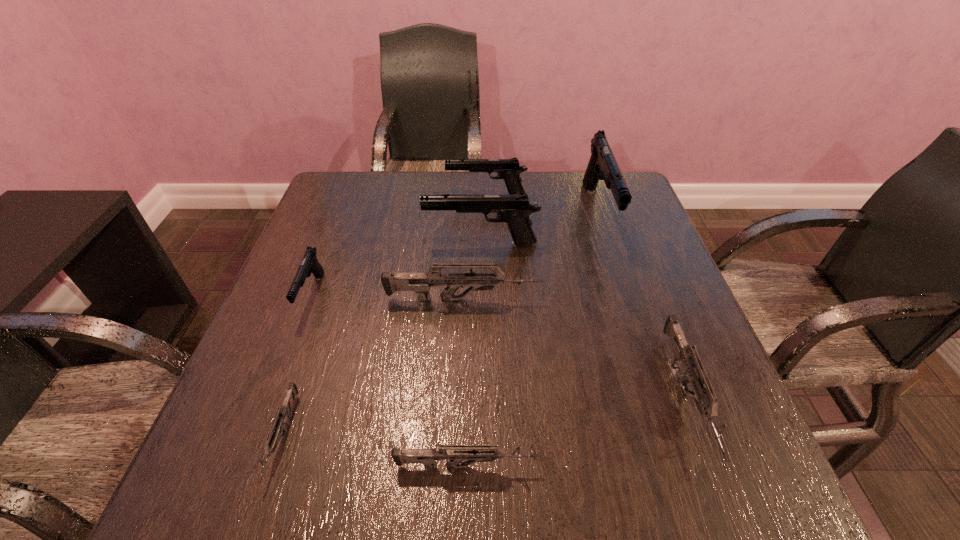
Locate an element on the screen. The height and width of the screenshot is (540, 960). free space located at the aiming end of the second smallest black gun is located at coordinates (374, 195).

You are a GUI agent. You are given a task and a screenshot of the screen. Output one action in this format:
    pyautogui.click(x=<x>, y=<y>)
    Task: Click on the free location located aimed along the barrel of the farthest grey gun
    The image size is (960, 540).
    Given the screenshot: What is the action you would take?
    pyautogui.click(x=654, y=299)

This screenshot has width=960, height=540. Identify the location of free spot located at the aiming end of the leftmost gun. (251, 457).

Image resolution: width=960 pixels, height=540 pixels. In order to click on free spot located 0.350m aimed along the barrel of the third biggest grey gun in this screenshot , I will do `click(764, 466)`.

You are a GUI agent. You are given a task and a screenshot of the screen. Output one action in this format:
    pyautogui.click(x=<x>, y=<y>)
    Task: Click on the object positioned at the near left corner
    This screenshot has width=960, height=540.
    Given the screenshot: What is the action you would take?
    pyautogui.click(x=273, y=438)

You are a GUI agent. You are given a task and a screenshot of the screen. Output one action in this format:
    pyautogui.click(x=<x>, y=<y>)
    Task: Click on the object at the far right corner
    Image resolution: width=960 pixels, height=540 pixels.
    Given the screenshot: What is the action you would take?
    pyautogui.click(x=602, y=165)

Where is `object that is at the near right corner`? object that is at the near right corner is located at coordinates (706, 402).

I want to click on blank space at the far edge, so click(x=540, y=180).

You are a GUI agent. You are given a task and a screenshot of the screen. Output one action in this format:
    pyautogui.click(x=<x>, y=<y>)
    Task: Click on the vacant region at the near edge of the desktop
    This screenshot has width=960, height=540.
    Given the screenshot: What is the action you would take?
    pyautogui.click(x=317, y=449)

Where is `vacant area at the left edge of the desktop`? The height and width of the screenshot is (540, 960). vacant area at the left edge of the desktop is located at coordinates (305, 281).